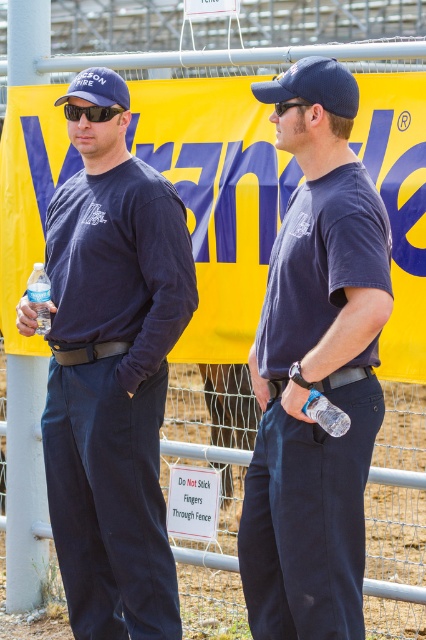
You are a photographer trying to capture a clear shot of the yellow banner. There is a clear plastic bottle at left in the way. Can you move the bottle to the right side of the frame to get a better view?

The clear plastic bottle at left is currently at point [40,296]. Moving it to the right side of the frame would require placing it beyond the current x coordinate of 0.464 to ensure the yellow banner is visible without obstruction.

You are a photographer positioned at the scene. You want to capture a clear shot of the matte blue shirt at center without any obstructions. Given the distance, what adjustment should you make to your camera?

The matte blue shirt at center is 5.57 meters away from the camera. To capture a clear shot without obstructions, adjust the camera focus to 5.57 meters and ensure there are no objects blocking the line of sight between the camera and the matte blue shirt at center.

You are a safety inspector checking the distance between the clear plastic bottle at left and the black plastic goggles at center. According to safety regulations, the minimum required distance is 1.5 meters. Is the current distance compliant?

The distance between the clear plastic bottle at left and the black plastic goggles at center is 1.53 meters, which exceeds the minimum requirement of 1.5 meters. Therefore, the current distance is compliant with safety regulations.